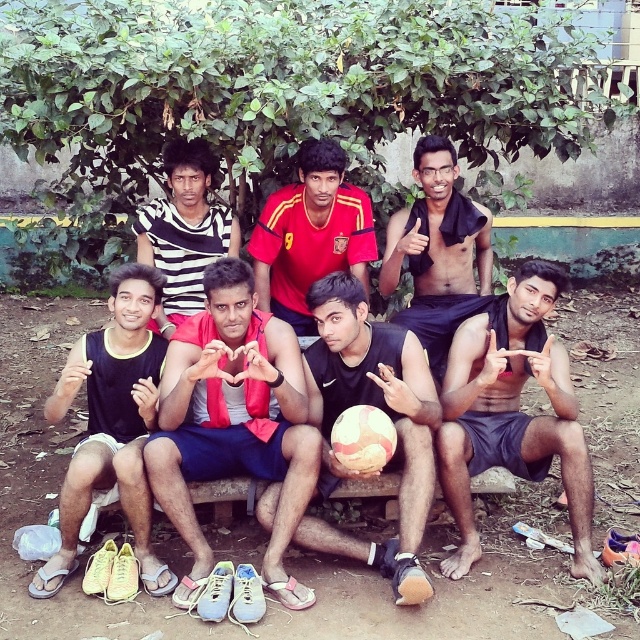
Is red jersey at center further to the viewer compared to striped fabric shirt at center?

No.

Can you confirm if red jersey at center is shorter than striped fabric shirt at center?

Indeed, red jersey at center has a lesser height compared to striped fabric shirt at center.

Is point (355, 214) positioned before point (168, 180)?

Yes, point (355, 214) is in front of point (168, 180).

Find the location of `red jersey at center`. red jersey at center is located at coordinates (310, 234).

Can you confirm if dark gray shorts at center is bigger than black matte tank top at center?

Yes, dark gray shorts at center is bigger than black matte tank top at center.

Which is in front, point (550, 435) or point (68, 532)?

Point (68, 532) is more forward.

Image resolution: width=640 pixels, height=640 pixels. In order to click on dark gray shorts at center in this screenshot , I will do `click(513, 412)`.

Locate an element on the screen. This screenshot has height=640, width=640. dark gray shorts at center is located at coordinates (513, 412).

Which of these two, black matte tank top at center or red jersey at center, stands taller?

black matte tank top at center

Who is positioned more to the right, black matte tank top at center or red jersey at center?

Positioned to the right is red jersey at center.

Image resolution: width=640 pixels, height=640 pixels. What are the coordinates of `black matte tank top at center` in the screenshot? It's located at (112, 424).